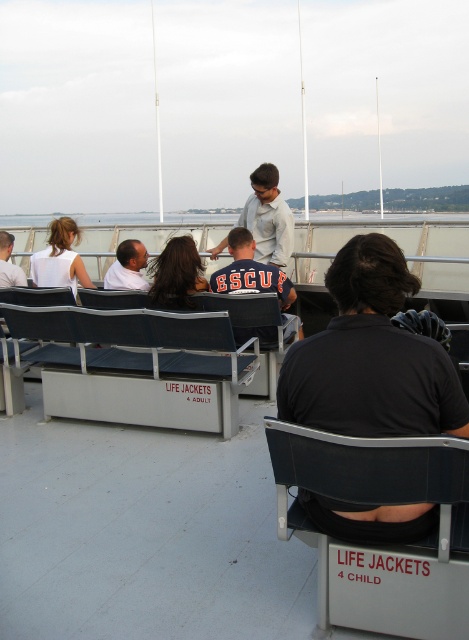
You are standing on the ferry deck and need to reach the front row life jackets. There are two points marked on the deck floor, one at point coordinates (339, 305) and another at (287, 300). Which point should you step on to move closer to the front row life jackets?

Point (339, 305) is in front of point (287, 300), so stepping on point (339, 305) will bring you closer to the front row life jackets.